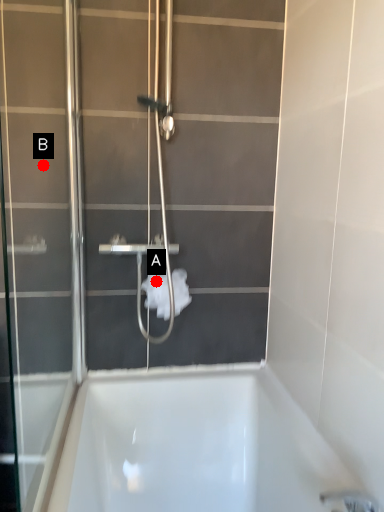
Question: Two points are circled on the image, labeled by A and B beside each circle. Which of the following is the closest to the observer?

Choices:
 (A) A is closer
 (B) B is closer

Answer: (B)